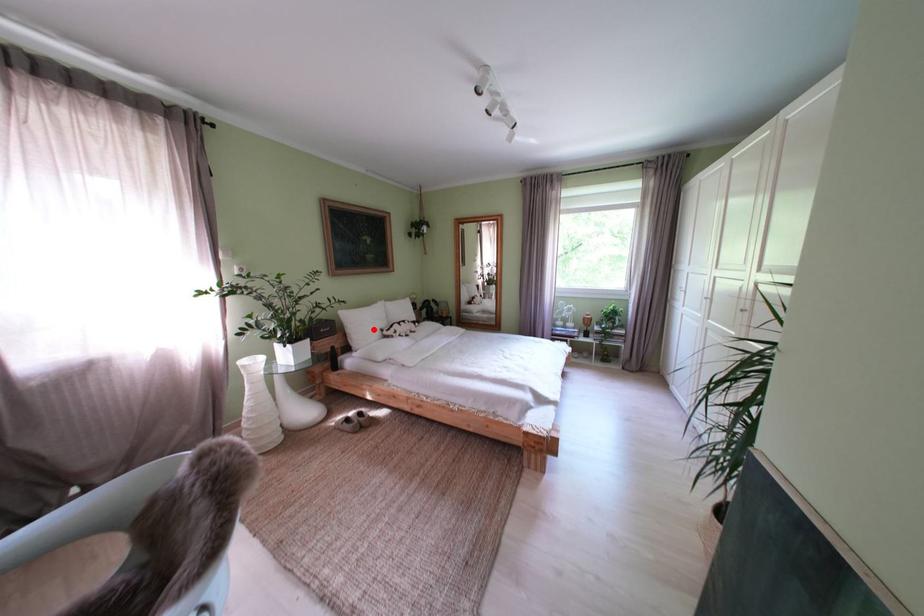
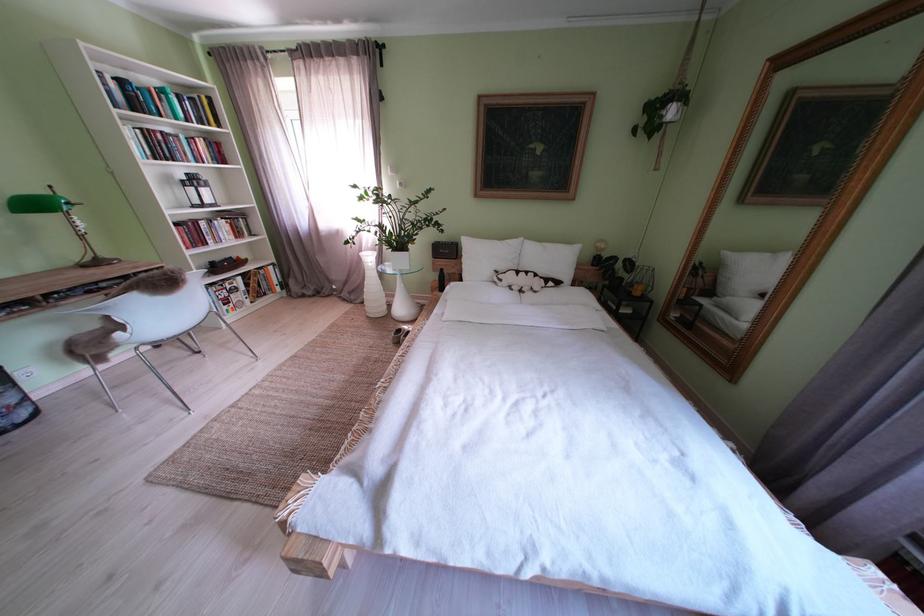
Locate, in the second image, the point that corresponds to the highlighted location in the first image.

(490, 262)